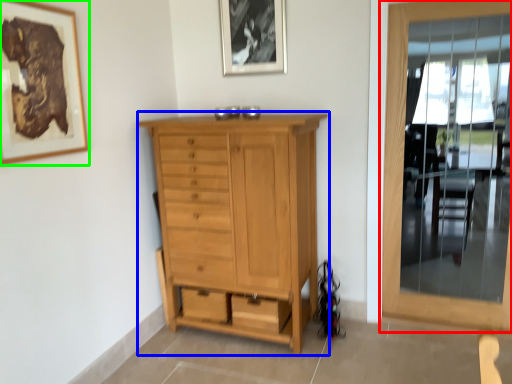
Question: Estimate the real-world distances between objects in this image. Which object is closer to door (highlighted by a red box), chest of drawers (highlighted by a blue box) or picture frame (highlighted by a green box)?

Choices:
 (A) chest of drawers
 (B) picture frame

Answer: (A)